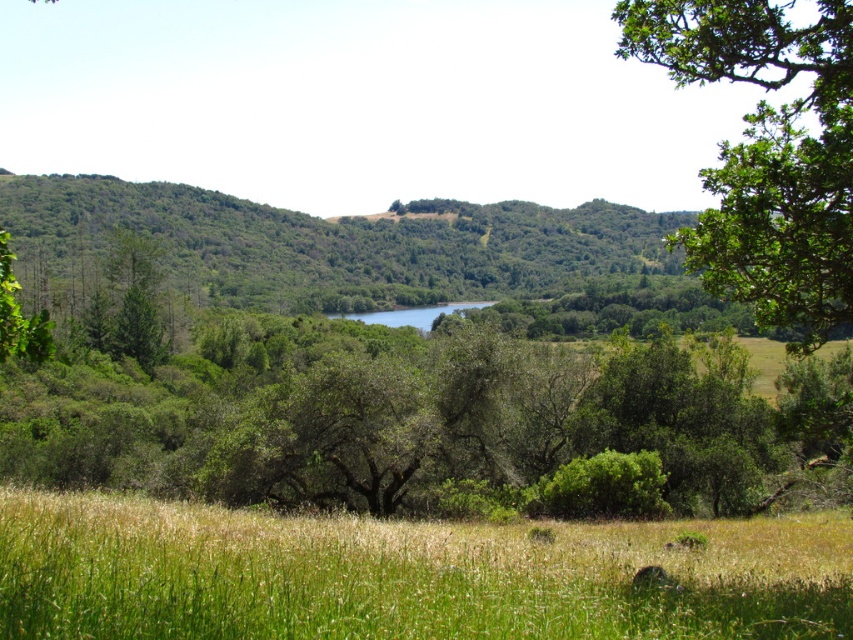
You are planning to plant a new tree in your backyard and want to choose between two options based on their sizes. You see the green leafy tree at center and the green leafy tree at upper right in the image. Which tree would you choose if you want a larger tree for shade?

The green leafy tree at center is bigger than the green leafy tree at upper right, so you should choose the green leafy tree at center for a larger tree that provides more shade.

You are standing at the origin point of the coordinate system in the image. You want to walk to the green leafy tree at center. What are the coordinates you need to move to?

You need to move to the coordinates point at (410, 416) to reach the green leafy tree at center.

You are standing in the grassy field and want to walk towards the green leafy tree at upper right. Which direction should you head relative to the green leafy tree at center?

You should head to the right of the green leafy tree at center because the green leafy tree at upper right is located to the right side of the green leafy tree at center.